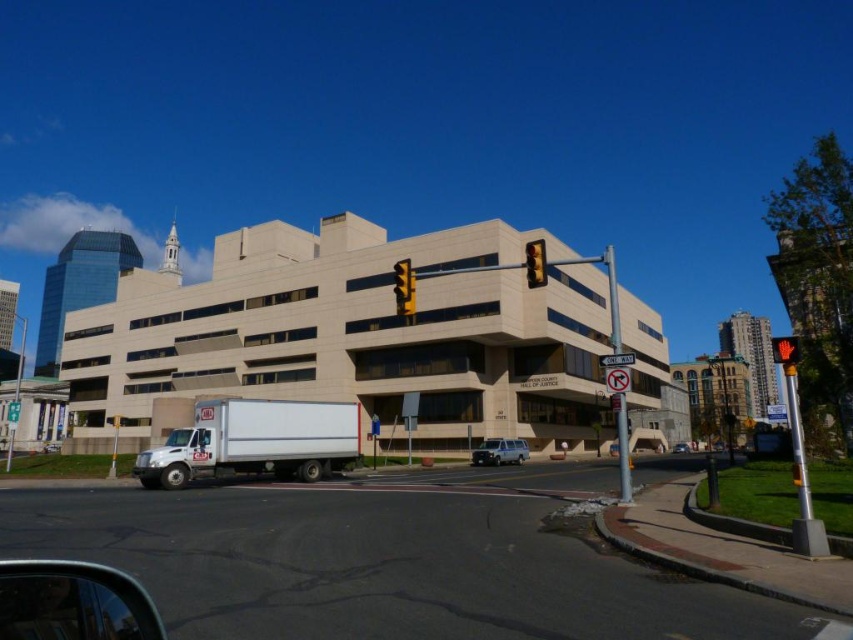
You are a pedestrian standing at the crosswalk in front of the HALL OF JUSTICE building. You need to cross the street to the white matte truck at lower left. Based on the traffic light positions, can you safely cross now?

The white matte truck at lower left is located at point [254,442]. Since the traffic lights are yellow, it is advisable to wait until the light turns green before attempting to cross for safety reasons.

You are a pedestrian standing at the crosswalk near the traffic light pole with two yellow traffic lights. You want to cross the street to reach the silver metallic van at center. Which direction should you walk to get there?

Result: The silver metallic van at center is located at point (498,451), so you should walk towards the center of the street where the van is positioned.